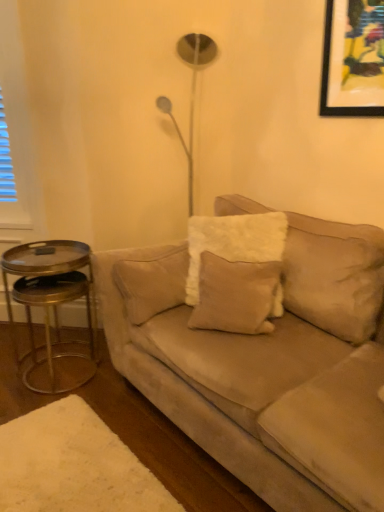
Question: Does gold metallic side table at left appear on the left side of suede beige couch at center?

Choices:
 (A) yes
 (B) no

Answer: (A)

Question: Is gold metallic side table at left completely or partially outside of suede beige couch at center?

Choices:
 (A) yes
 (B) no

Answer: (A)

Question: Is gold metallic side table at left to the right of suede beige couch at center from the viewer's perspective?

Choices:
 (A) yes
 (B) no

Answer: (B)

Question: From the image's perspective, does gold metallic side table at left appear lower than suede beige couch at center?

Choices:
 (A) no
 (B) yes

Answer: (B)

Question: From a real-world perspective, is gold metallic side table at left physically below suede beige couch at center?

Choices:
 (A) no
 (B) yes

Answer: (B)

Question: From a real-world perspective, is gold metallic side table at left positioned above or below beige velvet pillow at center?

Choices:
 (A) below
 (B) above

Answer: (A)

Question: In the image, is gold metallic side table at left on the left side or the right side of beige velvet pillow at center?

Choices:
 (A) left
 (B) right

Answer: (A)

Question: Is gold metallic side table at left inside or outside of beige velvet pillow at center?

Choices:
 (A) inside
 (B) outside

Answer: (B)

Question: Is point (11, 311) closer or farther from the camera than point (254, 268)?

Choices:
 (A) farther
 (B) closer

Answer: (A)

Question: From a real-world perspective, is suede beige couch at center physically located above or below beige velvet pillow at center?

Choices:
 (A) below
 (B) above

Answer: (A)

Question: Considering the positions of point (288, 416) and point (268, 323), is point (288, 416) closer or farther from the camera than point (268, 323)?

Choices:
 (A) farther
 (B) closer

Answer: (B)

Question: In the image, is suede beige couch at center on the left side or the right side of beige velvet pillow at center?

Choices:
 (A) left
 (B) right

Answer: (B)

Question: Looking at their shapes, would you say suede beige couch at center is wider or thinner than beige velvet pillow at center?

Choices:
 (A) wide
 (B) thin

Answer: (A)

Question: Considering the positions of beige velvet pillow at center and gold metallic side table at left in the image, is beige velvet pillow at center taller or shorter than gold metallic side table at left?

Choices:
 (A) short
 (B) tall

Answer: (A)

Question: From a real-world perspective, is beige velvet pillow at center physically located above or below gold metallic side table at left?

Choices:
 (A) above
 (B) below

Answer: (A)